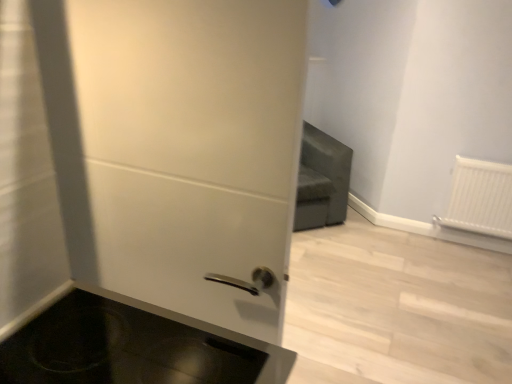
Measure the distance between white plastic radiator at right and camera.

The depth of white plastic radiator at right is 8.98 feet.

Describe the element at coordinates (192, 149) in the screenshot. I see `white matte door at center` at that location.

Consider the image. What is the approximate width of white matte door at center?

white matte door at center is 19.78 centimeters in width.

You are a GUI agent. You are given a task and a screenshot of the screen. Output one action in this format:
    pyautogui.click(x=<x>, y=<y>)
    Task: Click on the black glass cooktop at lower left
    
    Given the screenshot: What is the action you would take?
    pyautogui.click(x=134, y=347)

I want to click on door lying on the left of white plastic radiator at right, so click(x=192, y=149).

Considering the sizes of objects white plastic radiator at right and white matte door at center in the image provided, who is taller, white plastic radiator at right or white matte door at center?

white matte door at center is taller.

Which of these two, white plastic radiator at right or white matte door at center, is thinner?

white plastic radiator at right is thinner.

Is white plastic radiator at right positioned before white matte door at center?

No, the depth of white plastic radiator at right is greater than that of white matte door at center.

Is black glass cooktop at lower left far from white matte door at center?

No, black glass cooktop at lower left is in close proximity to white matte door at center.

Considering the relative sizes of black glass cooktop at lower left and white matte door at center in the image provided, is black glass cooktop at lower left shorter than white matte door at center?

Correct, black glass cooktop at lower left is not as tall as white matte door at center.

Between black glass cooktop at lower left and white matte door at center, which one has smaller size?

black glass cooktop at lower left.

Between point (470, 187) and point (134, 367), which one is positioned in front?

Point (134, 367)

From the image's perspective, which one is positioned higher, white plastic radiator at right or black glass cooktop at lower left?

From the image's view, white plastic radiator at right is above.

Is white plastic radiator at right aimed at black glass cooktop at lower left?

Yes, white plastic radiator at right faces towards black glass cooktop at lower left.

From the picture: From a real-world perspective, who is located lower, white plastic radiator at right or black glass cooktop at lower left?

white plastic radiator at right, from a real-world perspective.

Based on the photo, which point is more distant from viewer, (x=236, y=216) or (x=497, y=185)?

Positioned behind is point (x=497, y=185).

In the scene shown: Which of these two, white matte door at center or white plastic radiator at right, is thinner?

white plastic radiator at right.

How much distance is there between white matte door at center and white plastic radiator at right?

They are 2.46 meters apart.

Would you say white matte door at center is a long distance from white plastic radiator at right?

That's right, there is a large distance between white matte door at center and white plastic radiator at right.

Is black glass cooktop at lower left positioned with its back to white plastic radiator at right?

No, black glass cooktop at lower left is not facing the opposite direction of white plastic radiator at right.

The width and height of the screenshot is (512, 384). In the image, there is a white plastic radiator at right. What are the coordinates of `appliance below it (from the image's perspective)` in the screenshot? It's located at (134, 347).

Is black glass cooktop at lower left far away from white plastic radiator at right?

That's right, there is a large distance between black glass cooktop at lower left and white plastic radiator at right.

From a real-world perspective, is black glass cooktop at lower left located beneath white plastic radiator at right?

No, from a real-world perspective, black glass cooktop at lower left is not beneath white plastic radiator at right.

Is white matte door at center positioned with its back to black glass cooktop at lower left?

Absolutely, white matte door at center is directed away from black glass cooktop at lower left.

From the image's perspective, is white matte door at center positioned above or below black glass cooktop at lower left?

From the image's perspective, white matte door at center appears above black glass cooktop at lower left.

Is white matte door at center surrounding black glass cooktop at lower left?

Actually, black glass cooktop at lower left is outside white matte door at center.

Considering the sizes of objects white matte door at center and black glass cooktop at lower left in the image provided, who is wider, white matte door at center or black glass cooktop at lower left?

With larger width is black glass cooktop at lower left.

Find the location of `radiator that is above the white matte door at center (from the image's perspective)`. radiator that is above the white matte door at center (from the image's perspective) is located at coordinates (480, 198).

You are a GUI agent. You are given a task and a screenshot of the screen. Output one action in this format:
    pyautogui.click(x=<x>, y=<y>)
    Task: Click on the door on the left of black glass cooktop at lower left
    
    Given the screenshot: What is the action you would take?
    pyautogui.click(x=192, y=149)

When comparing their distances from black glass cooktop at lower left, does white matte door at center or white plastic radiator at right seem closer?

white matte door at center is positioned closer to the anchor black glass cooktop at lower left.

Which object lies further to the anchor point white plastic radiator at right, black glass cooktop at lower left or white matte door at center?

black glass cooktop at lower left lies further to white plastic radiator at right than the other object.

Based on the photo, considering their positions, is white plastic radiator at right positioned further to white matte door at center than black glass cooktop at lower left?

white plastic radiator at right is positioned further to the anchor white matte door at center.

Consider the image. From the image, which object appears to be nearer to white matte door at center, black glass cooktop at lower left or white plastic radiator at right?

Based on the image, black glass cooktop at lower left appears to be nearer to white matte door at center.

Based on their spatial positions, is white matte door at center or black glass cooktop at lower left further from white plastic radiator at right?

The object further to white plastic radiator at right is black glass cooktop at lower left.

When comparing their distances from black glass cooktop at lower left, does white plastic radiator at right or white matte door at center seem further?

Among the two, white plastic radiator at right is located further to black glass cooktop at lower left.

Identify the location of door positioned between black glass cooktop at lower left and white plastic radiator at right from near to far. The width and height of the screenshot is (512, 384). (192, 149).